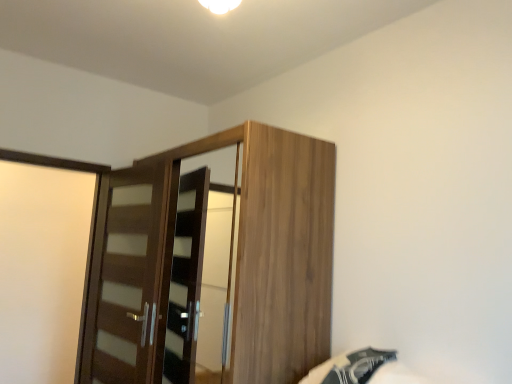
Question: Can you confirm if black fabric bed at lower right is wider than brown wood door at left?

Choices:
 (A) no
 (B) yes

Answer: (B)

Question: From the image's perspective, is black fabric bed at lower right located above brown wood door at left?

Choices:
 (A) yes
 (B) no

Answer: (B)

Question: Can you confirm if black fabric bed at lower right is shorter than brown wood door at left?

Choices:
 (A) no
 (B) yes

Answer: (B)

Question: From a real-world perspective, is black fabric bed at lower right physically below brown wood door at left?

Choices:
 (A) no
 (B) yes

Answer: (B)

Question: Is black fabric bed at lower right closer to camera compared to brown wood door at left?

Choices:
 (A) no
 (B) yes

Answer: (B)

Question: In terms of size, does black fabric bed at lower right appear bigger or smaller than brown wood door at left?

Choices:
 (A) small
 (B) big

Answer: (A)

Question: From a real-world perspective, is black fabric bed at lower right positioned above or below brown wood door at left?

Choices:
 (A) below
 (B) above

Answer: (A)

Question: In terms of height, does black fabric bed at lower right look taller or shorter compared to brown wood door at left?

Choices:
 (A) tall
 (B) short

Answer: (B)

Question: From the image's perspective, is black fabric bed at lower right located above or below brown wood door at left?

Choices:
 (A) below
 (B) above

Answer: (A)

Question: Is brown wood door at left taller or shorter than black fabric bed at lower right?

Choices:
 (A) short
 (B) tall

Answer: (B)

Question: Would you say brown wood door at left is inside or outside black fabric bed at lower right?

Choices:
 (A) inside
 (B) outside

Answer: (B)

Question: In terms of width, does brown wood door at left look wider or thinner when compared to black fabric bed at lower right?

Choices:
 (A) thin
 (B) wide

Answer: (A)

Question: Is point (140, 279) closer or farther from the camera than point (352, 352)?

Choices:
 (A) closer
 (B) farther

Answer: (B)

Question: From the image's perspective, is brown wood door at left located above or below wooden wardrobe at center?

Choices:
 (A) below
 (B) above

Answer: (B)

Question: Considering their positions, is brown wood door at left located in front of or behind wooden wardrobe at center?

Choices:
 (A) front
 (B) behind

Answer: (B)